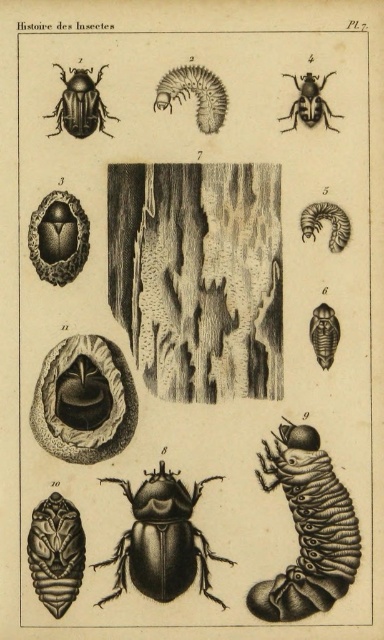
Question: Which of the following is the farthest from the observer?

Choices:
 (A) shiny metallic beetle at center-right
 (B) shiny black beetle at center
 (C) grayish-brown segmented caterpillar at upper right
 (D) shiny brown exoskeleton at lower left

Answer: (C)

Question: Which object appears closest to the camera in this image?

Choices:
 (A) shiny metallic beetle at center-right
 (B) smooth brown millipede at upper center
 (C) matte black beetle at upper center
 (D) shiny brown exoskeleton at lower left

Answer: (D)

Question: Estimate the real-world distances between objects in this image. Which object is closer to the smooth brown millipede at upper center?

Choices:
 (A) smooth black caterpillar at lower right
 (B) shiny metallic beetle at center-right
 (C) shiny black beetle at center
 (D) matte black beetle at upper center

Answer: (D)

Question: Is smooth black caterpillar at lower right to the right of shiny brown exoskeleton at lower left from the viewer's perspective?

Choices:
 (A) yes
 (B) no

Answer: (A)

Question: Is shiny black beetle at center closer to camera compared to smooth brown millipede at upper center?

Choices:
 (A) no
 (B) yes

Answer: (B)

Question: Is smooth black caterpillar at lower right wider than shiny metallic beetle at center-right?

Choices:
 (A) no
 (B) yes

Answer: (B)